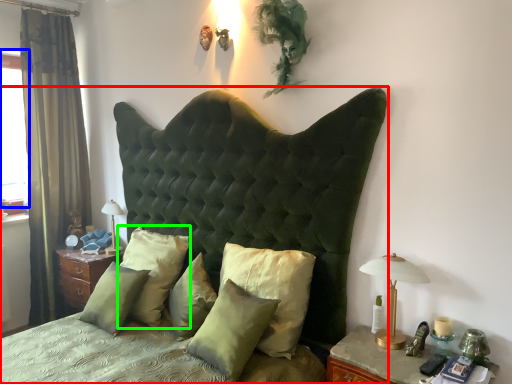
Question: Which is farther away from bed (highlighted by a red box)? window screen (highlighted by a blue box) or pillow (highlighted by a green box)?

Choices:
 (A) window screen
 (B) pillow

Answer: (A)